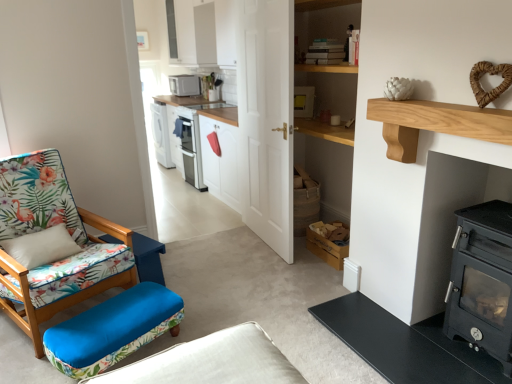
Question: Is light brown wood at upper right positioned far away from black matte wood burning stove at right?

Choices:
 (A) no
 (B) yes

Answer: (A)

Question: Is black matte wood burning stove at right located within light brown wood at upper right?

Choices:
 (A) yes
 (B) no

Answer: (B)

Question: Can you confirm if light brown wood at upper right is taller than black matte wood burning stove at right?

Choices:
 (A) no
 (B) yes

Answer: (A)

Question: From the image's perspective, is light brown wood at upper right below black matte wood burning stove at right?

Choices:
 (A) no
 (B) yes

Answer: (A)

Question: Is light brown wood at upper right placed right next to black matte wood burning stove at right?

Choices:
 (A) no
 (B) yes

Answer: (A)

Question: Is light brown wood at upper right behind black matte wood burning stove at right?

Choices:
 (A) no
 (B) yes

Answer: (A)

Question: Can you confirm if black matte wood burning stove at right is bigger than light brown wood at upper right?

Choices:
 (A) yes
 (B) no

Answer: (A)

Question: Is black matte wood burning stove at right touching light brown wood at upper right?

Choices:
 (A) yes
 (B) no

Answer: (B)

Question: From the image's perspective, is black matte wood burning stove at right below light brown wood at upper right?

Choices:
 (A) yes
 (B) no

Answer: (A)

Question: Would you consider black matte wood burning stove at right to be distant from light brown wood at upper right?

Choices:
 (A) no
 (B) yes

Answer: (A)

Question: From a real-world perspective, does black matte wood burning stove at right sit lower than light brown wood at upper right?

Choices:
 (A) no
 (B) yes

Answer: (B)

Question: Can you confirm if black matte wood burning stove at right is smaller than light brown wood at upper right?

Choices:
 (A) yes
 (B) no

Answer: (B)

Question: From the image's perspective, is floral fabric chair at left on blue floral fabric studio couch at lower left?

Choices:
 (A) yes
 (B) no

Answer: (A)